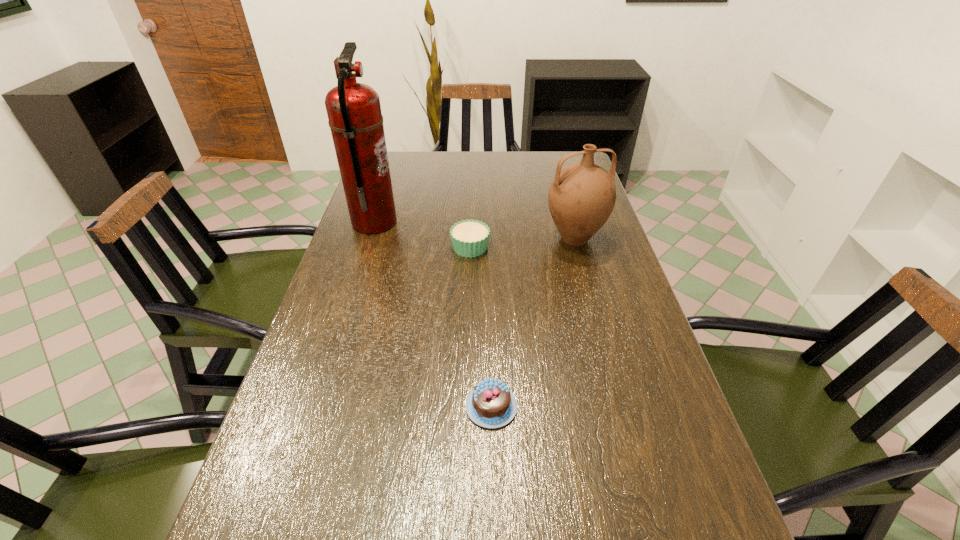
This screenshot has height=540, width=960. Identify the location of free spot between the fire extinguisher and the cupcake. (422, 235).

Find the location of a particular element. The image size is (960, 540). free space between the cupcake and the tallest object is located at coordinates (422, 235).

Find the location of `object that can be found as the closest to the leftmost object`. object that can be found as the closest to the leftmost object is located at coordinates (469, 238).

The height and width of the screenshot is (540, 960). I want to click on the closest object to the cupcake, so [581, 198].

I want to click on free spot that satisfies the following two spatial constraints: 1. on the nozzle side of the pitcher; 2. on the right side of the fire extinguisher, so click(x=369, y=239).

Locate an element on the screen. The height and width of the screenshot is (540, 960). vacant area in the image that satisfies the following two spatial constraints: 1. on the nozzle side of the nearest object; 2. on the left side of the leftmost object is located at coordinates (316, 406).

Locate an element on the screen. This screenshot has width=960, height=540. vacant space that satisfies the following two spatial constraints: 1. on the back side of the second tallest object; 2. on the nozzle side of the tallest object is located at coordinates (570, 222).

The image size is (960, 540). Identify the location of free space that satisfies the following two spatial constraints: 1. on the nozzle side of the leftmost object; 2. on the back side of the cupcake. (367, 247).

I want to click on free spot that satisfies the following two spatial constraints: 1. on the nozzle side of the cupcake; 2. on the left side of the fire extinguisher, so click(367, 247).

The image size is (960, 540). In order to click on vacant space that satisfies the following two spatial constraints: 1. on the nozzle side of the leftmost object; 2. on the right side of the rightmost object in this screenshot , I will do `click(369, 239)`.